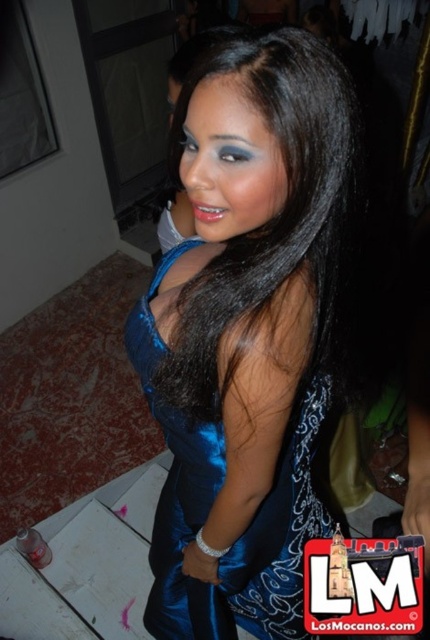
Question: From the image, what is the correct spatial relationship of satin black hair at center in relation to satin blue dress at center?

Choices:
 (A) left
 (B) right

Answer: (B)

Question: Among these points, which one is farthest from the camera?

Choices:
 (A) (325, 529)
 (B) (199, 374)

Answer: (A)

Question: Can you confirm if satin black hair at center is positioned below satin blue dress at center?

Choices:
 (A) yes
 (B) no

Answer: (B)

Question: Which point is closer to the camera?

Choices:
 (A) (260, 616)
 (B) (285, 266)

Answer: (B)

Question: Can you confirm if satin black hair at center is smaller than satin blue dress at center?

Choices:
 (A) no
 (B) yes

Answer: (B)